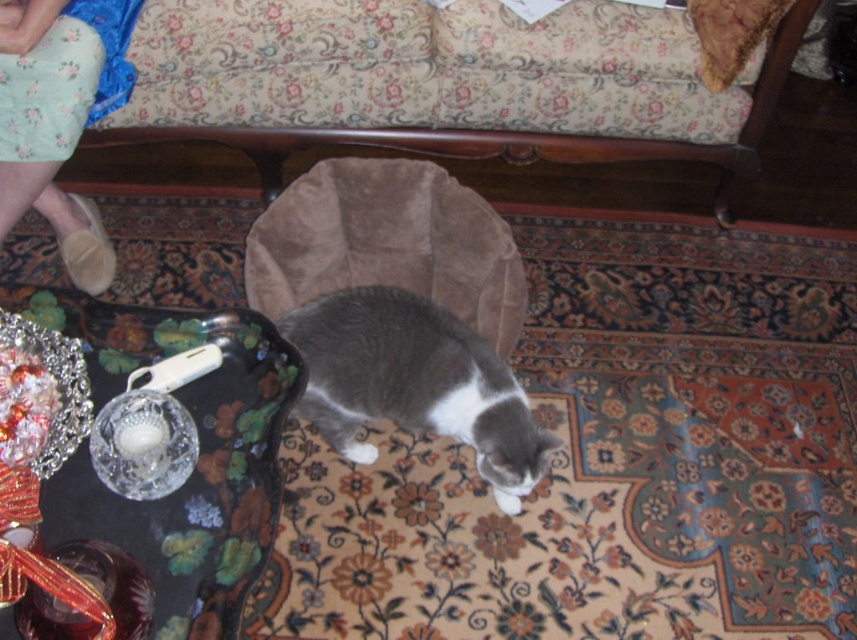
A robotic vacuum cleaner with a diameter of 30 centimeters is navigating through the living room. It needs to move from the suede cat bed at center to the velvet cushion at upper right. Can it travel in a straight line without encountering any obstacles between them?

The distance between the suede cat bed at center and velvet cushion at upper right is 75.05 centimeters. Since the robotic vacuum cleaner has a diameter of 30 centimeters, it can move in a straight line between them as there is sufficient space.

You are standing in the living room and want to sit down on the suede couch at center. Based on its position, where should you walk towards to reach it?

The suede couch at center is located at point 0.209 on the x and 0.595 on the y coordinates, so you should walk towards the center of the room where the coordinates indicate the couch is positioned.